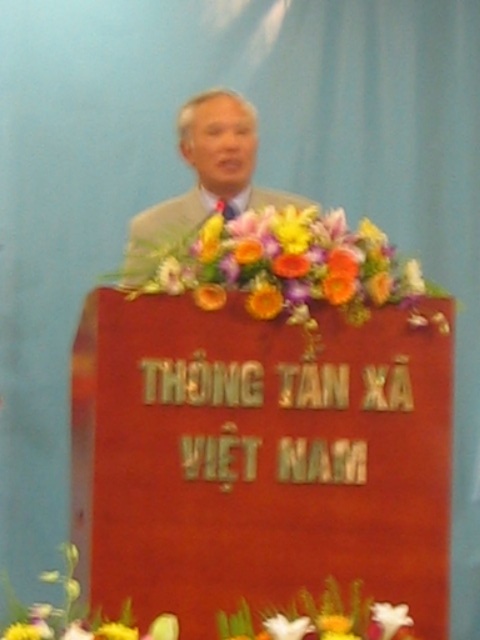
Question: Which of the following is the farthest from the observer?

Choices:
 (A) light gray suit at center
 (B) vibrant bouquet at center

Answer: (A)

Question: Is vibrant bouquet at center above light gray suit at center?

Choices:
 (A) no
 (B) yes

Answer: (A)

Question: Which object is positioned farthest from the light gray suit at center?

Choices:
 (A) red wood sign at center
 (B) vibrant bouquet at center

Answer: (A)

Question: Is red wood sign at center wider than vibrant bouquet at center?

Choices:
 (A) no
 (B) yes

Answer: (B)

Question: Considering the relative positions of red wood sign at center and vibrant bouquet at center in the image provided, where is red wood sign at center located with respect to vibrant bouquet at center?

Choices:
 (A) right
 (B) left

Answer: (B)

Question: Which of the following is the farthest from the observer?

Choices:
 (A) pos(232,202)
 (B) pos(240,525)

Answer: (A)